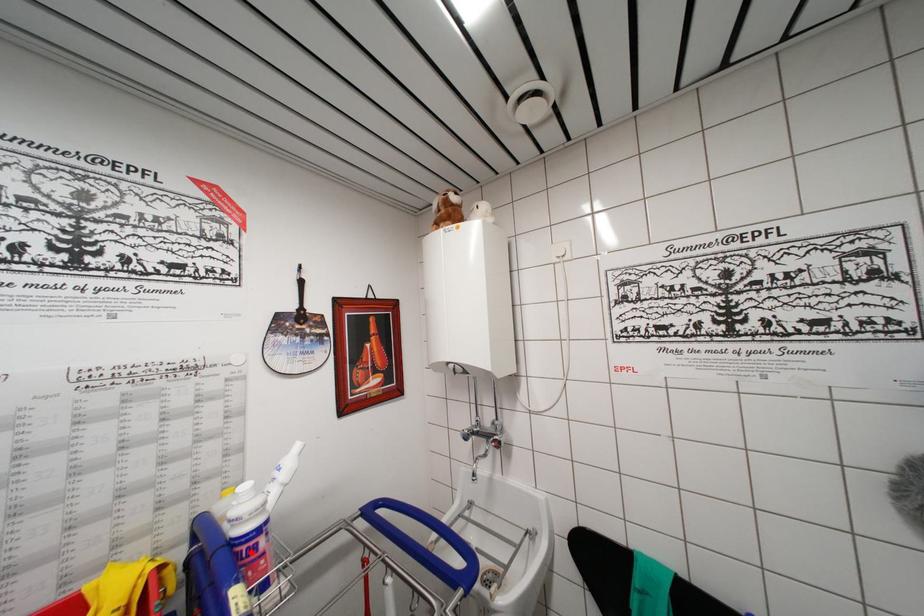
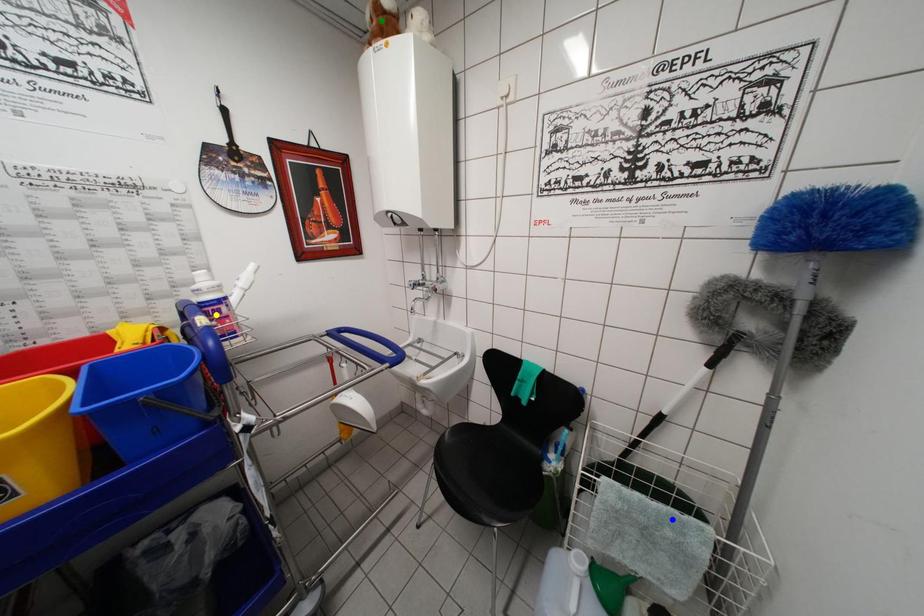
Question: I am providing you with two images of the same scene from different viewpoints. A red point is marked on the first image. You are given multiple points on the second image. Can you choose the point in image 2 that corresponds to the point in image 1?

Choices:
 (A) green point
 (B) yellow point
 (C) blue point

Answer: (B)